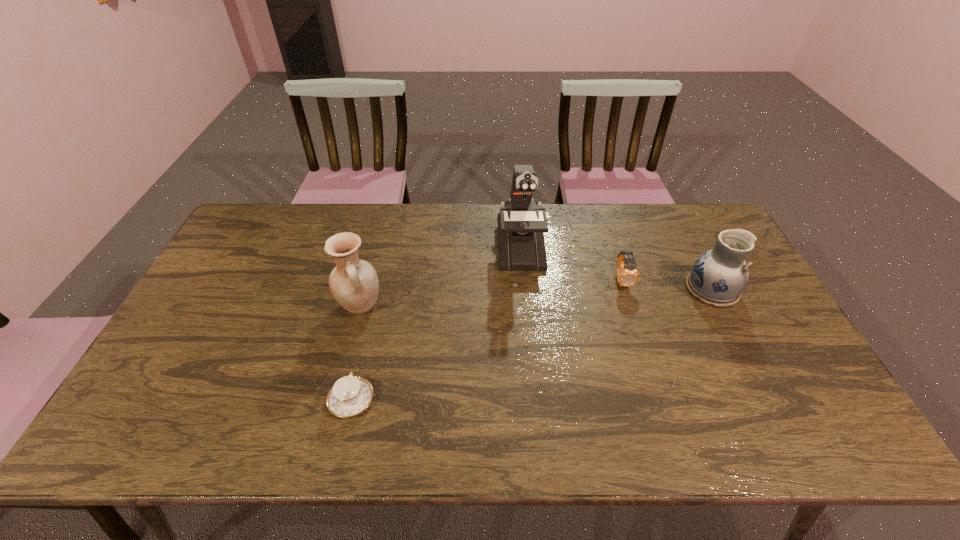
I want to click on vacant space located 0.370m on the right of the left pottery, so click(510, 306).

This screenshot has height=540, width=960. Find the location of `vacant space located on the back of the shorter pottery`. vacant space located on the back of the shorter pottery is located at coordinates (672, 211).

Find the location of a particular element. Image resolution: width=960 pixels, height=540 pixels. free space located on the face of the second object from right to left is located at coordinates (660, 401).

Locate an element on the screen. This screenshot has height=540, width=960. free space located on the side with the handle of the teacup is located at coordinates coord(375,293).

In order to click on vacant area situated on the side with the handle of the teacup in this screenshot , I will do `click(361, 357)`.

Locate an element on the screen. free region located 0.280m on the side with the handle of the teacup is located at coordinates click(x=374, y=298).

The height and width of the screenshot is (540, 960). Find the location of `object situated at the far edge`. object situated at the far edge is located at coordinates (520, 224).

Where is `object located in the near edge section of the desktop`? This screenshot has width=960, height=540. object located in the near edge section of the desktop is located at coordinates (350, 395).

I want to click on object located at the right edge, so (719, 276).

In order to click on vacant space at the far edge in this screenshot , I will do `click(440, 232)`.